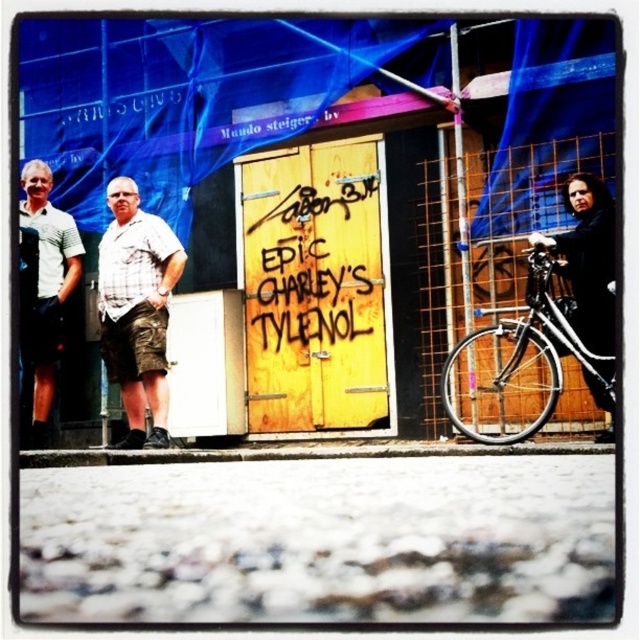
Does plaid shirt at center have a lesser width compared to matte black jacket at left?

Incorrect, plaid shirt at center's width is not less than matte black jacket at left's.

Is plaid shirt at center smaller than matte black jacket at left?

Correct, plaid shirt at center occupies less space than matte black jacket at left.

Between point (102, 237) and point (36, 388), which one is positioned in front?

Point (102, 237) is more forward.

Identify the location of plaid shirt at center. The image size is (640, 640). (136, 308).

What do you see at coordinates (314, 264) in the screenshot? I see `yellow painted wood door at center` at bounding box center [314, 264].

Between point (320, 326) and point (538, 232), which one is positioned in front?

Positioned in front is point (538, 232).

At what (x,y) coordinates should I click in order to perform the action: click on yellow painted wood door at center. Please return your answer as a coordinate pair (x, y). Looking at the image, I should click on (314, 264).

Identify the location of yellow painted wood door at center. (314, 264).

Can you confirm if black matte coat at right is smaller than matte black jacket at left?

Correct, black matte coat at right occupies less space than matte black jacket at left.

Is black matte coat at right shorter than matte black jacket at left?

Correct, black matte coat at right is not as tall as matte black jacket at left.

In the scene shown: Who is more distant from viewer, (589,308) or (81,257)?

Point (81,257)

You are a GUI agent. You are given a task and a screenshot of the screen. Output one action in this format:
    pyautogui.click(x=<x>, y=<y>)
    Task: Click on the black matte coat at right
    
    Given the screenshot: What is the action you would take?
    pyautogui.click(x=588, y=259)